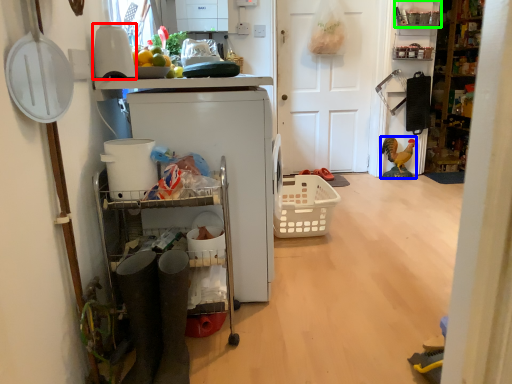
Question: Considering the real-world distances, which object is closest to appliance (highlighted by a red box)? toy (highlighted by a blue box) or shelf (highlighted by a green box).

Choices:
 (A) toy
 (B) shelf

Answer: (B)